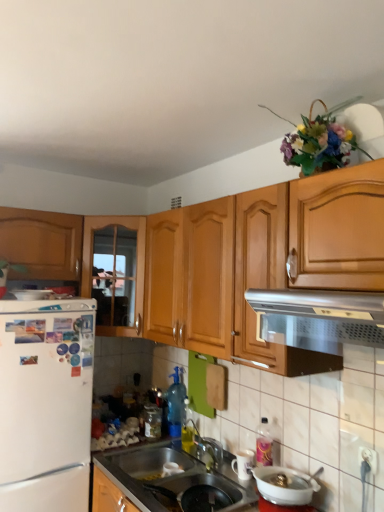
Question: Is metallic stainless steel sink at lower center further to camera compared to wooden cabinet at left, which is the 2th cabinetry from right to left?

Choices:
 (A) no
 (B) yes

Answer: (A)

Question: Is metallic stainless steel sink at lower center thinner than wooden cabinet at left, which is the 2th cabinetry from right to left?

Choices:
 (A) no
 (B) yes

Answer: (A)

Question: Can you confirm if metallic stainless steel sink at lower center is bigger than wooden cabinet at left, which ranks as the first cabinetry in left-to-right order?

Choices:
 (A) yes
 (B) no

Answer: (B)

Question: Can wooden cabinet at left, which is the 2th cabinetry from right to left, be found inside metallic stainless steel sink at lower center?

Choices:
 (A) no
 (B) yes

Answer: (A)

Question: Is metallic stainless steel sink at lower center not inside wooden cabinet at left, which is the 2th cabinetry from right to left?

Choices:
 (A) no
 (B) yes

Answer: (B)

Question: Is metallic stainless steel sink at lower center taller than wooden cabinet at left, which ranks as the first cabinetry in left-to-right order?

Choices:
 (A) yes
 (B) no

Answer: (B)

Question: From the image's perspective, does wooden cabinet at left, placed as the second cabinetry when sorted from left to right, appear lower than transparent plastic spray bottle at center, which is counted as the 2th bottle, starting from the left?

Choices:
 (A) yes
 (B) no

Answer: (B)

Question: From a real-world perspective, is wooden cabinet at left, placed as the second cabinetry when sorted from left to right, under transparent plastic spray bottle at center, which is counted as the 2th bottle, starting from the left?

Choices:
 (A) yes
 (B) no

Answer: (B)

Question: Would you say wooden cabinet at left, positioned as the first cabinetry in right-to-left order, contains transparent plastic spray bottle at center, the first bottle viewed from the right?

Choices:
 (A) no
 (B) yes

Answer: (A)

Question: Is wooden cabinet at left, placed as the second cabinetry when sorted from left to right, further to camera compared to transparent plastic spray bottle at center, the first bottle viewed from the right?

Choices:
 (A) no
 (B) yes

Answer: (A)

Question: Is wooden cabinet at left, placed as the second cabinetry when sorted from left to right, located outside transparent plastic spray bottle at center, which is counted as the 2th bottle, starting from the left?

Choices:
 (A) no
 (B) yes

Answer: (B)

Question: Does wooden cabinet at left, positioned as the first cabinetry in right-to-left order, have a smaller size compared to transparent plastic spray bottle at center, the first bottle viewed from the right?

Choices:
 (A) no
 (B) yes

Answer: (A)

Question: Is wooden cabinet at left, positioned as the first cabinetry in right-to-left order, thinner than white glossy bowl at lower center, arranged as the 3th appliance when viewed from the left?

Choices:
 (A) yes
 (B) no

Answer: (B)